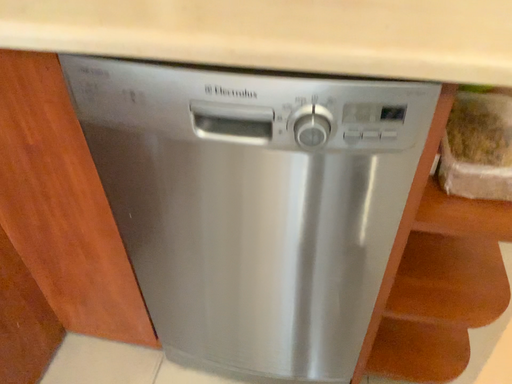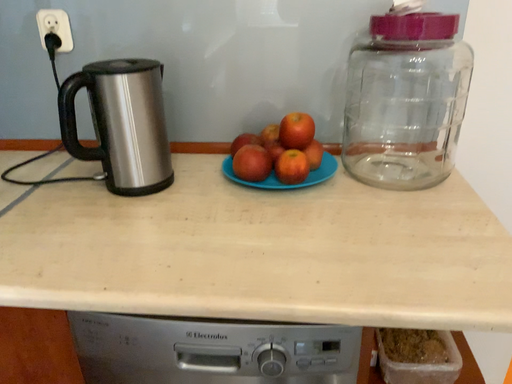
Question: Which way did the camera rotate in the video?

Choices:
 (A) rotated upward
 (B) rotated downward

Answer: (A)